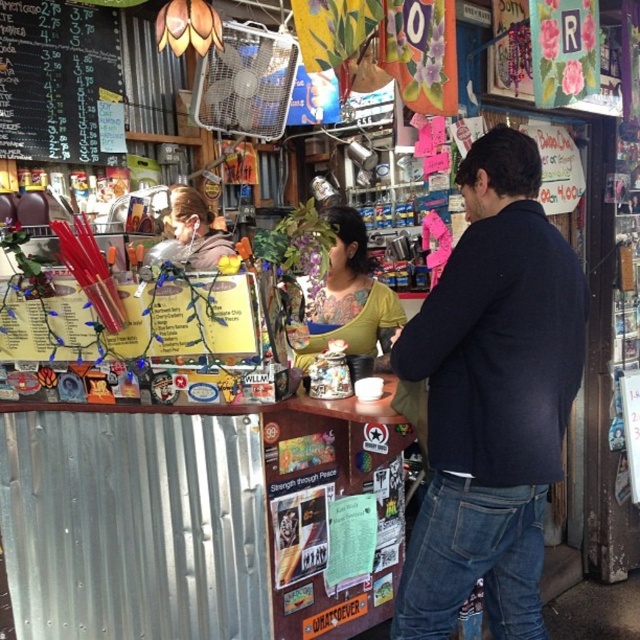
Can you confirm if yellow matte shirt at center is wider than matte black hair at center?

No, yellow matte shirt at center is not wider than matte black hair at center.

Does yellow matte shirt at center lie in front of matte black hair at center?

No, yellow matte shirt at center is behind matte black hair at center.

Find the location of a particular element. This screenshot has height=640, width=640. yellow matte shirt at center is located at coordinates (349, 298).

In the scene shown: Can you confirm if black chalkboard menu at upper left is thinner than matte black hair at center?

Indeed, black chalkboard menu at upper left has a lesser width compared to matte black hair at center.

Is the position of black chalkboard menu at upper left more distant than that of matte black hair at center?

Yes, it is behind matte black hair at center.

Is point (68, 144) farther from camera compared to point (177, 218)?

Yes, point (68, 144) is behind point (177, 218).

Locate an element on the screen. The image size is (640, 640). black chalkboard menu at upper left is located at coordinates (60, 83).

You are a GUI agent. You are given a task and a screenshot of the screen. Output one action in this format:
    pyautogui.click(x=<x>, y=<y>)
    Task: Click on the dark blue sweater at center
    The height and width of the screenshot is (640, 640).
    Given the screenshot: What is the action you would take?
    pyautogui.click(x=492, y=397)

Is dark blue sweater at center below yellow matte shirt at center?

Indeed, dark blue sweater at center is positioned under yellow matte shirt at center.

Is point (449, 412) farther from camera compared to point (308, 356)?

No, (449, 412) is in front of (308, 356).

Where is `dark blue sweater at center`? Image resolution: width=640 pixels, height=640 pixels. dark blue sweater at center is located at coordinates (492, 397).